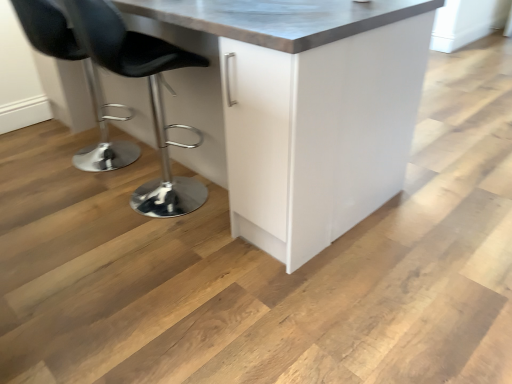
The width and height of the screenshot is (512, 384). I want to click on space that is in front of black leather stool at left, the second chair viewed from the right, so click(x=68, y=195).